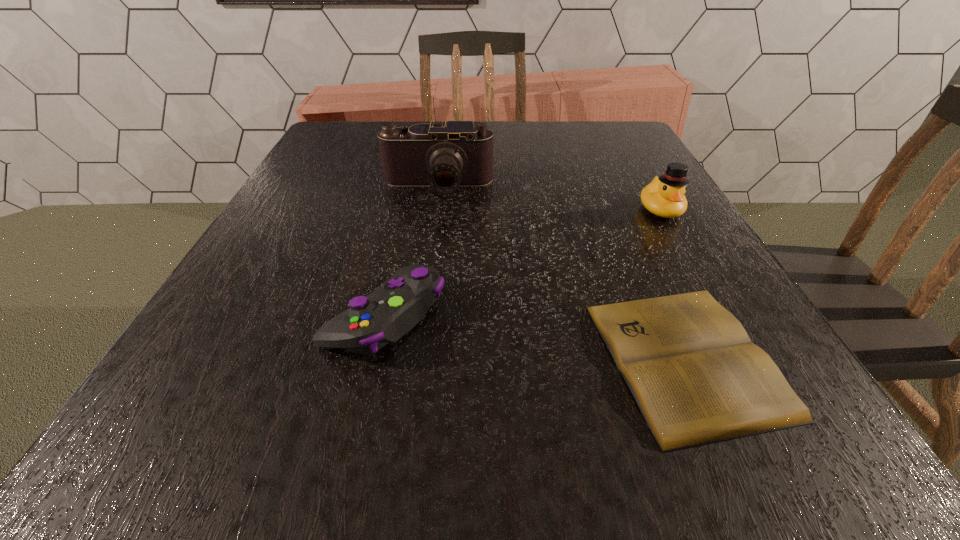
Locate an element on the screen. book located in the right edge section of the desktop is located at coordinates (697, 378).

Locate an element on the screen. This screenshot has height=540, width=960. object positioned at the near right corner is located at coordinates (697, 378).

The height and width of the screenshot is (540, 960). I want to click on vacant space at the far edge, so click(x=563, y=121).

This screenshot has width=960, height=540. In the image, there is a desktop. In order to click on vacant space at the near edge in this screenshot , I will do `click(500, 433)`.

The width and height of the screenshot is (960, 540). In order to click on blank space at the left edge in this screenshot , I will do `click(347, 221)`.

Find the location of a particular element. Image resolution: width=960 pixels, height=540 pixels. vacant space at the right edge of the desktop is located at coordinates (628, 267).

What are the coordinates of `vacant space at the far left corner of the desktop` in the screenshot? It's located at (359, 153).

In the image, there is a desktop. Where is `vacant space at the far right corner`? vacant space at the far right corner is located at coordinates [611, 138].

This screenshot has width=960, height=540. What are the coordinates of `vacant space at the near right corner` in the screenshot? It's located at (856, 471).

Locate an element on the screen. empty space between the third shortest object and the camera is located at coordinates (549, 198).